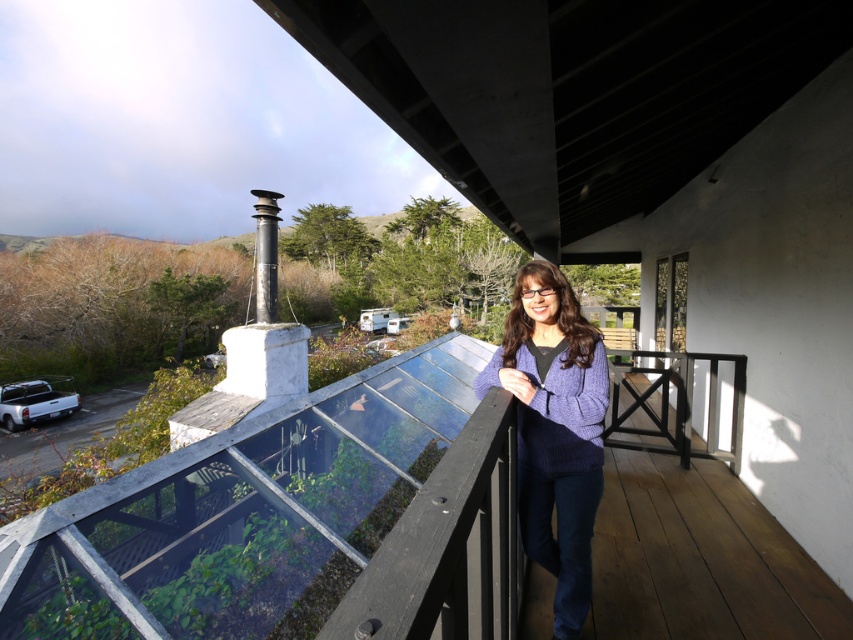
Question: Estimate the real-world distances between objects in this image. Which object is closer to the wooden porch at center?

Choices:
 (A) purple knitted sweater at center
 (B) black metallic chimney at upper left
 (C) wooden deck at center

Answer: (A)

Question: Which is nearer to the black metallic chimney at upper left?

Choices:
 (A) purple knitted sweater at center
 (B) wooden porch at center
 (C) wooden deck at center

Answer: (B)

Question: Is purple knitted sweater at center in front of black metallic chimney at upper left?

Choices:
 (A) yes
 (B) no

Answer: (A)

Question: Can you confirm if wooden deck at center is positioned below purple knitted sweater at center?

Choices:
 (A) no
 (B) yes

Answer: (B)

Question: Does wooden deck at center have a larger size compared to black metallic chimney at upper left?

Choices:
 (A) yes
 (B) no

Answer: (B)

Question: Which of the following is the farthest from the observer?

Choices:
 (A) wooden porch at center
 (B) black metallic chimney at upper left
 (C) purple knitted sweater at center

Answer: (B)